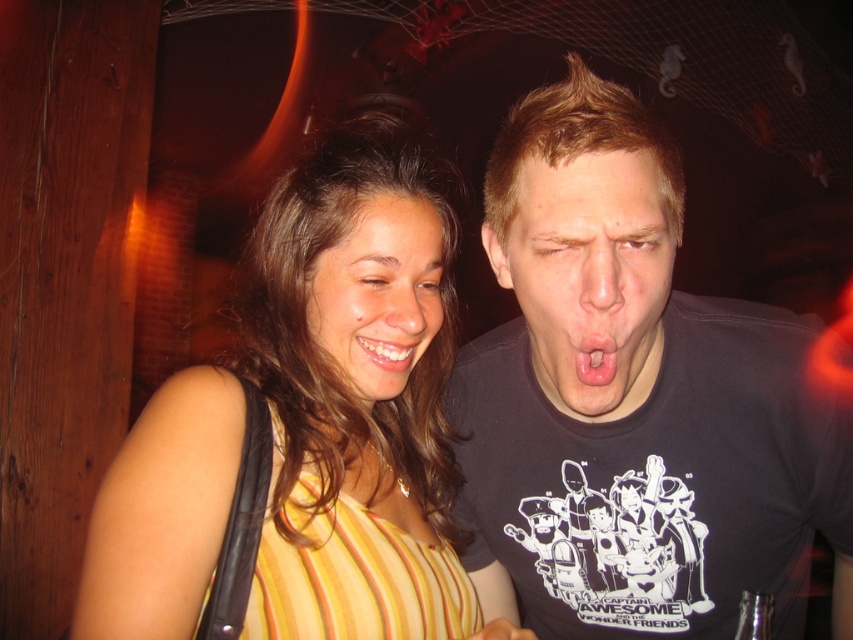
Can you confirm if matte black shirt at center is thinner than smooth skin face at center?

No, matte black shirt at center is not thinner than smooth skin face at center.

Does matte black shirt at center appear under smooth skin face at center?

Actually, matte black shirt at center is above smooth skin face at center.

Find the location of a particular element. matte black shirt at center is located at coordinates (589, 275).

This screenshot has height=640, width=853. Find the location of `matte black shirt at center`. matte black shirt at center is located at coordinates (589, 275).

Image resolution: width=853 pixels, height=640 pixels. What do you see at coordinates (378, 294) in the screenshot?
I see `smooth skin face at center` at bounding box center [378, 294].

Is smooth skin face at center taller than pink matte tongue at center?

Yes, smooth skin face at center is taller than pink matte tongue at center.

Locate an element on the screen. smooth skin face at center is located at coordinates (378, 294).

In order to click on smooth skin face at center in this screenshot , I will do `click(378, 294)`.

Can you confirm if matte black shirt at center is taller than white glossy teeth at lower center?

Yes.

Looking at this image, who is positioned more to the right, matte black shirt at center or white glossy teeth at lower center?

matte black shirt at center is more to the right.

The image size is (853, 640). Find the location of `matte black shirt at center`. matte black shirt at center is located at coordinates (589, 275).

Where is `matte black shirt at center`? matte black shirt at center is located at coordinates (589, 275).